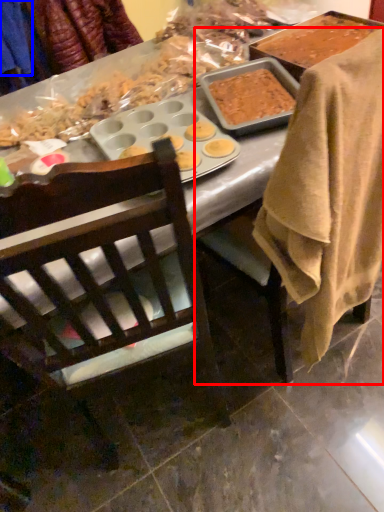
Question: Which object appears closest to the camera in this image, chair (highlighted by a red box) or clothing (highlighted by a blue box)?

Choices:
 (A) chair
 (B) clothing

Answer: (A)